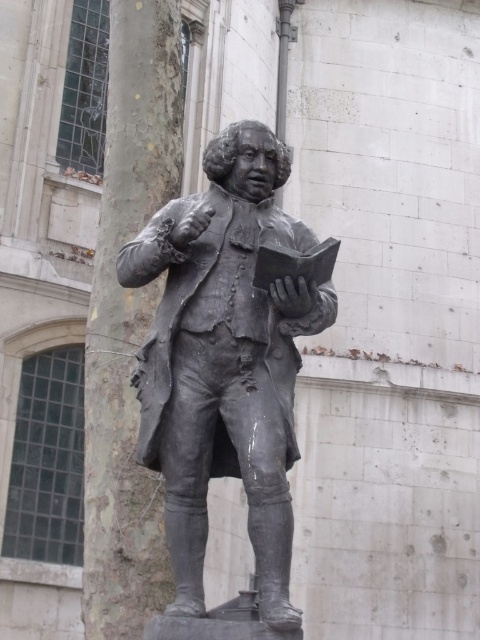
You are a tour guide explaining the layout of the statue in the park. Where exactly is the bronze statue at center located in terms of coordinates?

The bronze statue at center is located at coordinates point (225, 360).

You are a tour guide explaining the statue and the tree to visitors. You want to compare their heights. Which is shorter, the bronze statue at center or the smooth bark tree trunk at left?

The bronze statue at center is not as tall as the smooth bark tree trunk at left, so the bronze statue at center is shorter.